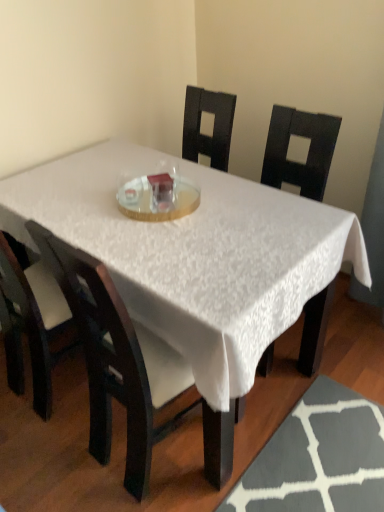
Question: From a real-world perspective, is matte black chair at center, positioned as the 2th chair in right-to-left order, above or below white textured table at center?

Choices:
 (A) below
 (B) above

Answer: (B)

Question: From the image's perspective, is matte black chair at center, which is the 1th chair from left to right, above or below white textured table at center?

Choices:
 (A) below
 (B) above

Answer: (B)

Question: Which object is the farthest from the matte black chair at center, which is the 1th chair from left to right?

Choices:
 (A) white textured table at center
 (B) clear glass plate at center
 (C) matte black chair at center, acting as the 2th chair starting from the left

Answer: (B)

Question: Which is farther from the white textured table at center?

Choices:
 (A) clear glass plate at center
 (B) matte black chair at center, positioned as the 2th chair in right-to-left order
 (C) matte black chair at center, the first chair when ordered from right to left

Answer: (B)